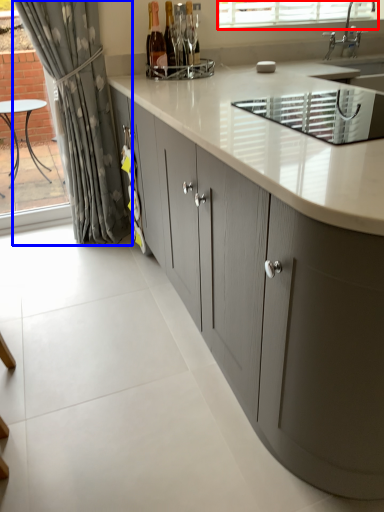
Question: Which object appears farthest to the camera in this image, bay window (highlighted by a red box) or curtain (highlighted by a blue box)?

Choices:
 (A) bay window
 (B) curtain

Answer: (A)